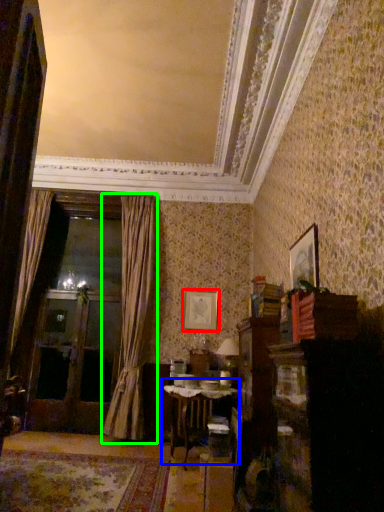
Question: Considering the real-world distances, which object is farthest from picture frame (highlighted by a red box)? table (highlighted by a blue box) or curtain (highlighted by a green box)?

Choices:
 (A) table
 (B) curtain

Answer: (A)